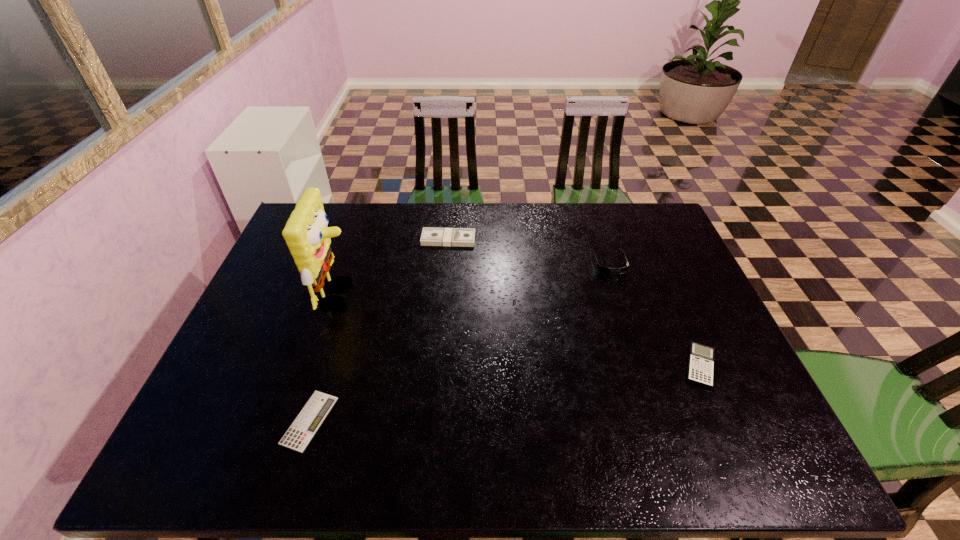
Where is `vacant point located between the fourth tallest object and the sponge`? vacant point located between the fourth tallest object and the sponge is located at coordinates (520, 330).

Locate an element on the screen. Image resolution: width=960 pixels, height=540 pixels. free space between the shortest object and the fourth shortest object is located at coordinates point(459,341).

Where is `free space between the second object from right to left and the shorter calculator`? The image size is (960, 540). free space between the second object from right to left and the shorter calculator is located at coordinates (459, 341).

Choose which object is the nearest neighbor to the tallest object. Please provide its 2D coordinates. Your answer should be formatted as a tuple, i.e. [(x, y)], where the tuple contains the x and y coordinates of a point satisfying the conditions above.

[(461, 237)]

Find the location of a particular element. The height and width of the screenshot is (540, 960). object identified as the third closest to the dollar is located at coordinates (301, 432).

Find the location of a particular element. This screenshot has height=540, width=960. vacant space that satisfies the following two spatial constraints: 1. on the back side of the second shortest object; 2. on the face of the sponge is located at coordinates (669, 294).

Find the location of `free space that satisfies the following two spatial constraints: 1. on the face of the second shortest object; 2. on the right side of the sponge`. free space that satisfies the following two spatial constraints: 1. on the face of the second shortest object; 2. on the right side of the sponge is located at coordinates (316, 366).

Locate an element on the screen. The width and height of the screenshot is (960, 540). free point that satisfies the following two spatial constraints: 1. on the face of the left calculator; 2. on the left side of the sponge is located at coordinates (299, 421).

You are a GUI agent. You are given a task and a screenshot of the screen. Output one action in this format:
    pyautogui.click(x=<x>, y=<y>)
    Task: Click on the vacant space that satisfies the following two spatial constraints: 1. on the face of the sponge; 2. on the back side of the nearer calculator
    
    Given the screenshot: What is the action you would take?
    pyautogui.click(x=299, y=421)

The height and width of the screenshot is (540, 960). In order to click on vacant space that satisfies the following two spatial constraints: 1. on the face of the sponge; 2. on the left side of the shortest object in this screenshot , I will do `click(299, 421)`.